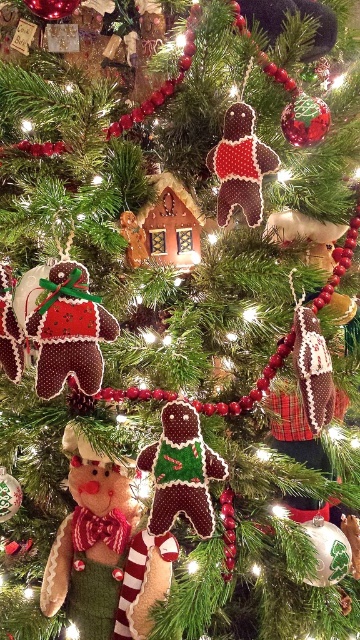
You are a child looking at the Christmas tree and want to pick the ornament that is closer to you. Which one would you choose between the green felt gingerbread man at center and the matte brown gingerbread man at center?

The green felt gingerbread man at center is in front of the matte brown gingerbread man at center, so it is closer to you and should be chosen.

You are a child trying to hang a new ornament on the Christmas tree. You have two gingerbread men to choose from. The green knitted gingerbread man at center and the green felt gingerbread man at center. Which one is wider so it can block more light from the tree lights underneath?

The green knitted gingerbread man at center is wider than the green felt gingerbread man at center, so it will block more light from the tree lights underneath.